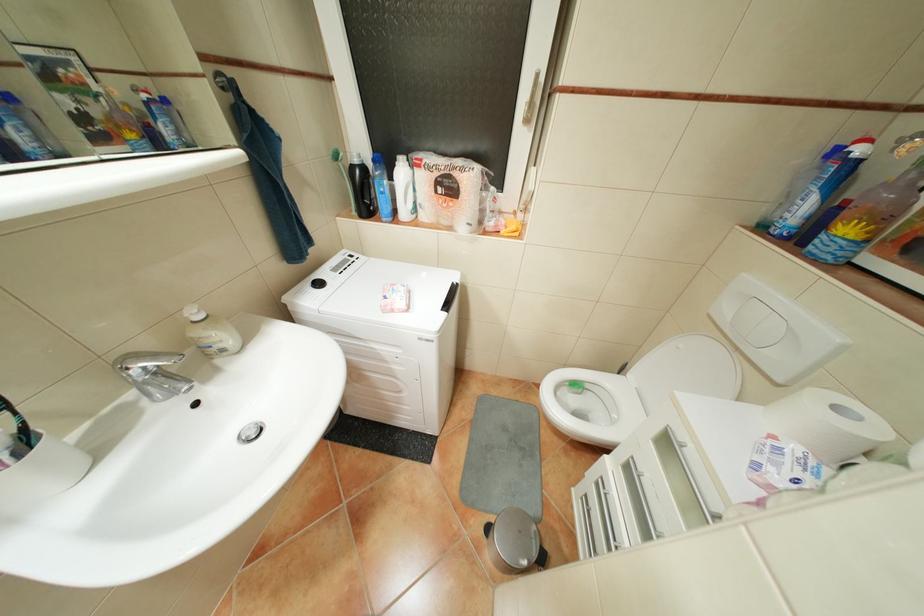
The height and width of the screenshot is (616, 924). I want to click on cabinet handle, so click(x=532, y=102).